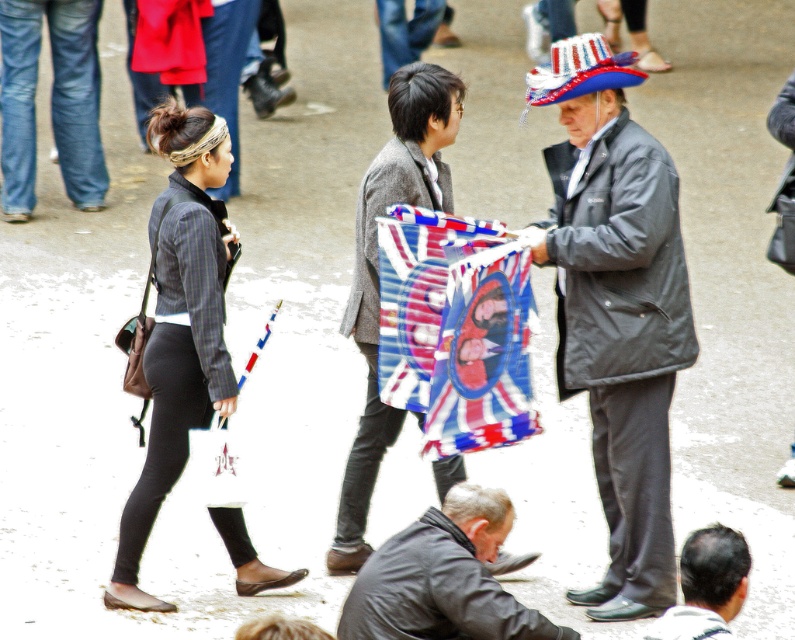
You are a delivery person who needs to place a package between the polyester flag at center and the textured gray coat at center. Can you fit the package there if it measures 24 inches in length?

The polyester flag at center and textured gray coat at center are 23.65 inches apart from each other. Since the package is 24 inches long, it cannot fit between them as the space is slightly smaller than the package.

You are a photographer standing at the center of the street scene. You want to take a picture of the dark gray jacket at lower center. Based on its 2D coordinates, where should you aim your camera to capture it in the frame?

The dark gray jacket at lower center is located at the 2D coordinates point (443, 579), so you should aim your camera towards that specific point to capture it in the frame.

In the scene shown: You are a photographer planning to take a photo of the polyester flag at center. The camera you are using has a focal length of 50mm and an aperture of f2.8. The flag is at point coordinates 0.514, 0.574. To ensure the flag is in focus, what should you adjust on your camera?

The position of polyester flag at center is at point (456,328). To ensure the flag is in focus, you should adjust the focus ring on your camera to set the focus point at coordinates (456,328).